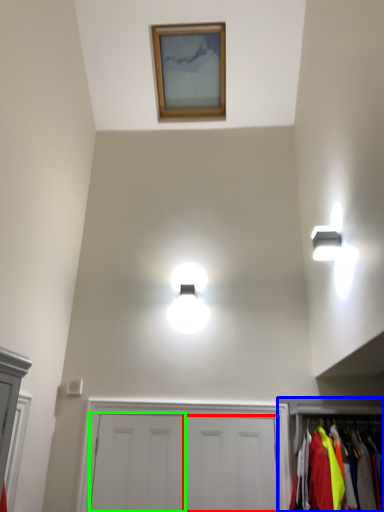
Question: Which is farther away from door (highlighted by a red box)? dresser (highlighted by a blue box) or door (highlighted by a green box)?

Choices:
 (A) dresser
 (B) door

Answer: (A)